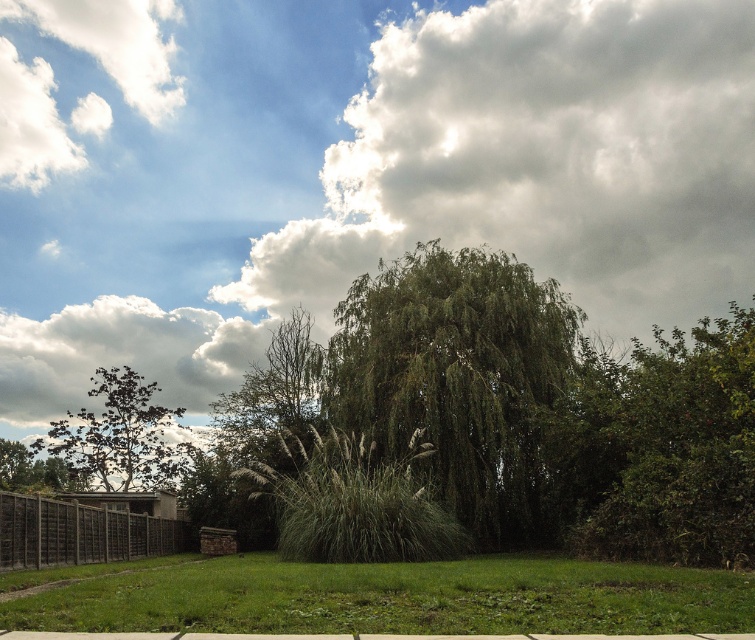
You are standing in the middle of the grassy area and want to walk towards the green leafy tree at left. Which direction should you turn to avoid the green leafy bush at right?

You should turn to the left to avoid the green leafy bush at right, as the green leafy tree at left is on the opposite side of the bush.

Looking at this image, you are standing in the middle of the scene and want to take a photo of the cloudy sky at upper center without the green grassy at lower center blocking the view. Is it possible?

The green grassy at lower center is behind the cloudy sky at upper center, so yes, you can take a photo of the cloudy sky at upper center without the green grassy at lower center blocking the view because the grass is positioned behind the sky.

Based on the photo, you are standing in the middle of the grassy area and want to walk towards the green leafy tree at left. However, there is a green leafy bush at right in your path. Can you walk directly to the tree without going around the bush?

The green leafy bush at right is in front of the green leafy tree at left, so you cannot walk directly to the tree without going around the bush because the bush is blocking the path.